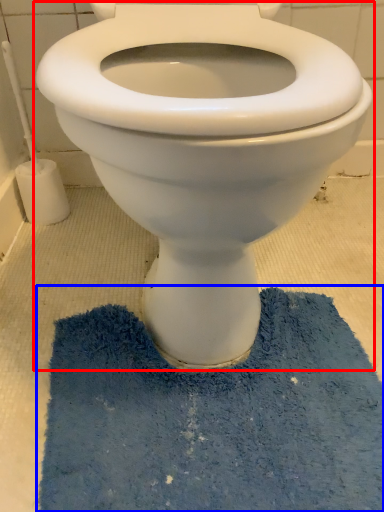
Question: Which object is further to the camera taking this photo, toilet (highlighted by a red box) or bath mat (highlighted by a blue box)?

Choices:
 (A) toilet
 (B) bath mat

Answer: (B)